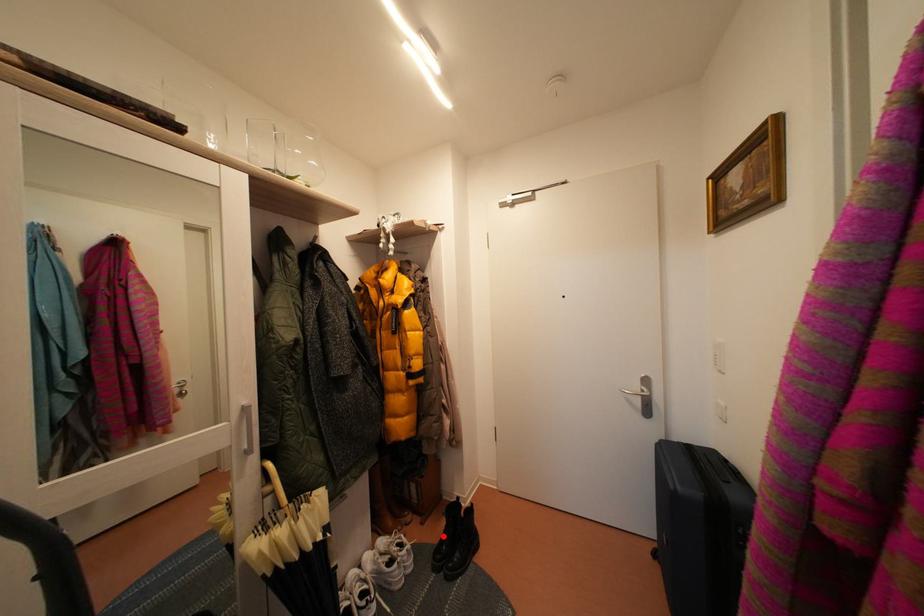
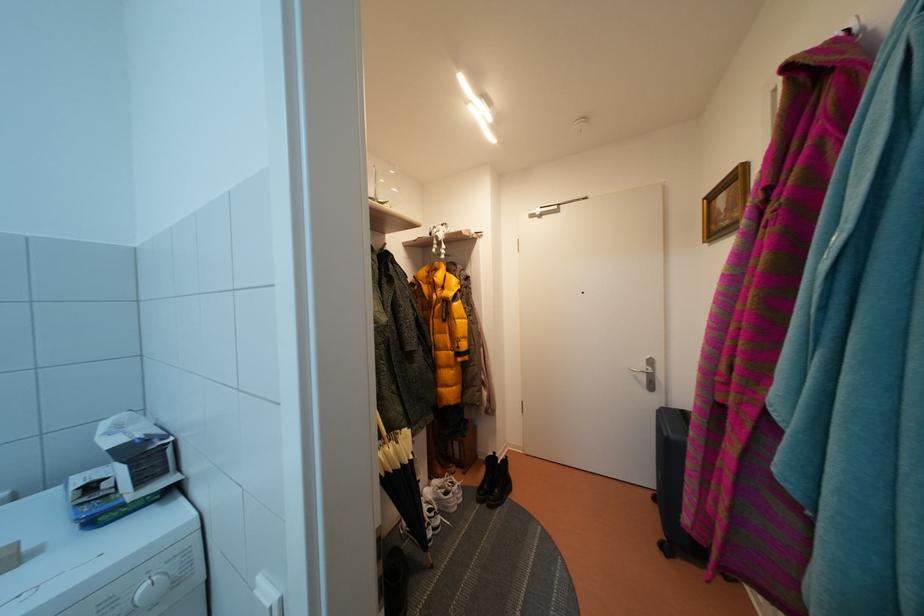
Where in the second image is the point corresponding to the highlighted location from the first image?

(484, 483)